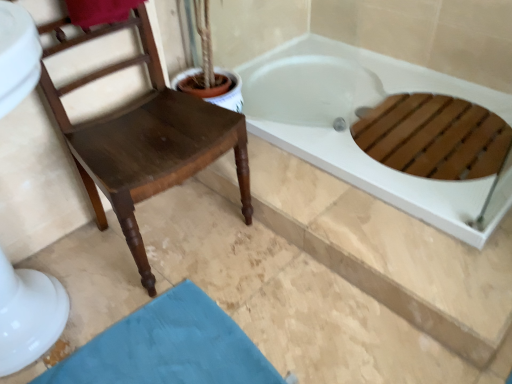
Question: From a real-world perspective, is white glossy bathtub at upper right over dark brown wood chair at left?

Choices:
 (A) yes
 (B) no

Answer: (B)

Question: Is white glossy bathtub at upper right smaller than dark brown wood chair at left?

Choices:
 (A) no
 (B) yes

Answer: (B)

Question: Is white glossy bathtub at upper right positioned with its back to dark brown wood chair at left?

Choices:
 (A) yes
 (B) no

Answer: (B)

Question: Can you confirm if white glossy bathtub at upper right is thinner than dark brown wood chair at left?

Choices:
 (A) no
 (B) yes

Answer: (A)

Question: Is white glossy bathtub at upper right directly adjacent to dark brown wood chair at left?

Choices:
 (A) no
 (B) yes

Answer: (A)

Question: From a real-world perspective, is teal fabric bath mat at lower left above or below white glossy bathtub at upper right?

Choices:
 (A) above
 (B) below

Answer: (B)

Question: Is teal fabric bath mat at lower left taller or shorter than white glossy bathtub at upper right?

Choices:
 (A) tall
 (B) short

Answer: (B)

Question: Is teal fabric bath mat at lower left bigger or smaller than white glossy bathtub at upper right?

Choices:
 (A) small
 (B) big

Answer: (A)

Question: Is teal fabric bath mat at lower left wider or thinner than white glossy bathtub at upper right?

Choices:
 (A) wide
 (B) thin

Answer: (B)

Question: From a real-world perspective, is teal fabric bath mat at lower left physically located above or below dark brown wood chair at left?

Choices:
 (A) above
 (B) below

Answer: (B)

Question: Is teal fabric bath mat at lower left to the left or to the right of dark brown wood chair at left in the image?

Choices:
 (A) left
 (B) right

Answer: (B)

Question: Is point (204, 306) closer or farther from the camera than point (137, 168)?

Choices:
 (A) closer
 (B) farther

Answer: (B)

Question: Is teal fabric bath mat at lower left in front of or behind dark brown wood chair at left in the image?

Choices:
 (A) behind
 (B) front

Answer: (A)

Question: In terms of height, does white glossy bathtub at upper right look taller or shorter compared to teal fabric bath mat at lower left?

Choices:
 (A) short
 (B) tall

Answer: (B)

Question: Relative to teal fabric bath mat at lower left, is white glossy bathtub at upper right in front or behind?

Choices:
 (A) front
 (B) behind

Answer: (B)